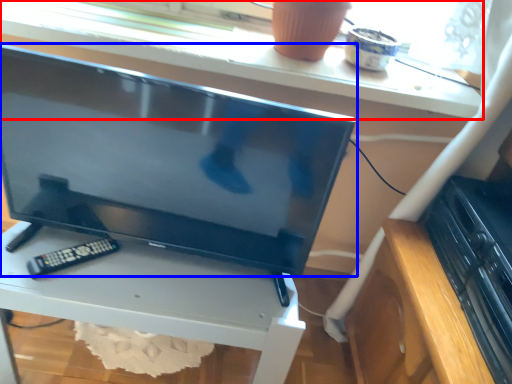
Question: Which of the following is the closest to the observer, window sill (highlighted by a red box) or television (highlighted by a blue box)?

Choices:
 (A) window sill
 (B) television

Answer: (B)